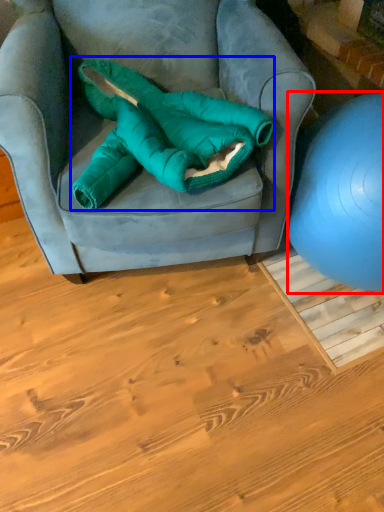
Question: Which object appears farthest to the camera in this image, ball (highlighted by a red box) or bean bag chair (highlighted by a blue box)?

Choices:
 (A) ball
 (B) bean bag chair

Answer: (B)